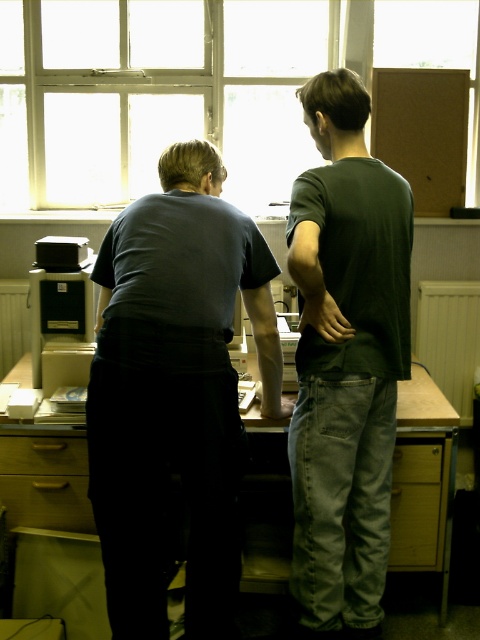
Does wooden drawer at lower right appear over wooden at lower left?

Actually, wooden drawer at lower right is below wooden at lower left.

Which is below, wooden drawer at lower right or wooden at lower left?

wooden drawer at lower right

The image size is (480, 640). What do you see at coordinates (416, 504) in the screenshot?
I see `wooden drawer at lower right` at bounding box center [416, 504].

Identify the location of wooden drawer at lower right. (416, 504).

Does transparent glass window at upper center come in front of wooden at lower right?

No, transparent glass window at upper center is further to the viewer.

Is transparent glass window at upper center bigger than wooden at lower right?

Correct, transparent glass window at upper center is larger in size than wooden at lower right.

Does point (279, 35) come behind point (440, 449)?

Yes, it is.

Find the location of a particular element. transparent glass window at upper center is located at coordinates (195, 88).

Is transparent glass window at upper center shorter than beech wood drawer at lower left?

Yes, transparent glass window at upper center is shorter than beech wood drawer at lower left.

Is the position of transparent glass window at upper center less distant than that of beech wood drawer at lower left?

No, transparent glass window at upper center is behind beech wood drawer at lower left.

The height and width of the screenshot is (640, 480). What are the coordinates of `transparent glass window at upper center` in the screenshot? It's located at (195, 88).